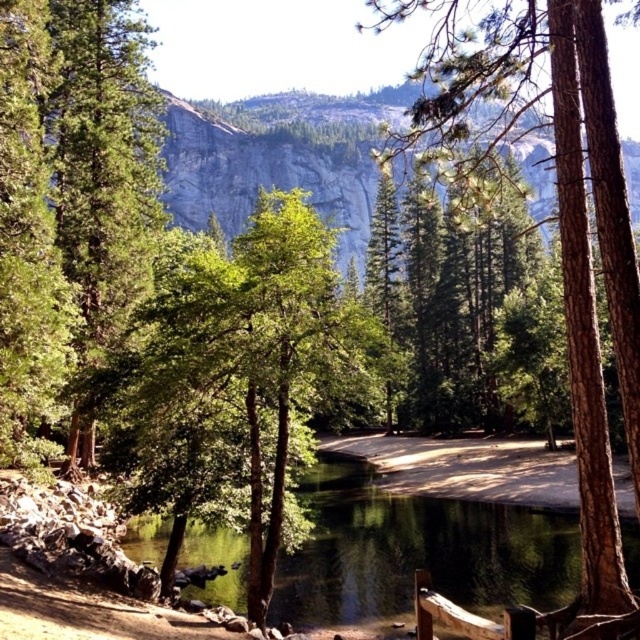
Question: Is green reflective water at center wider than green textured tree at left?

Choices:
 (A) no
 (B) yes

Answer: (B)

Question: Which point is farther to the camera?

Choices:
 (A) green reflective water at center
 (B) green textured tree at center

Answer: (A)

Question: Which point is farther from the camera taking this photo?

Choices:
 (A) (1, 440)
 (B) (141, 529)
 (C) (426, 118)

Answer: (B)

Question: Which of the following is the farthest from the observer?

Choices:
 (A) green reflective water at center
 (B) green textured tree at left
 (C) green textured tree at center

Answer: (A)

Question: Observing the image, what is the correct spatial positioning of green textured tree at center in reference to green textured tree at left?

Choices:
 (A) below
 (B) above

Answer: (B)

Question: Can you confirm if green reflective water at center is positioned above green textured tree at left?

Choices:
 (A) yes
 (B) no

Answer: (B)